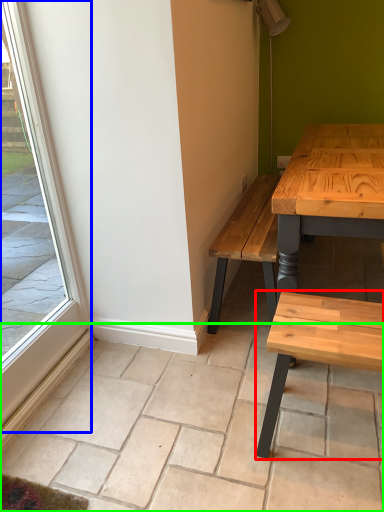
Question: Which object is positioned farthest from coffee table (highlighted by a red box)? Select from window (highlighted by a blue box) and tile (highlighted by a green box).

Choices:
 (A) window
 (B) tile

Answer: (A)